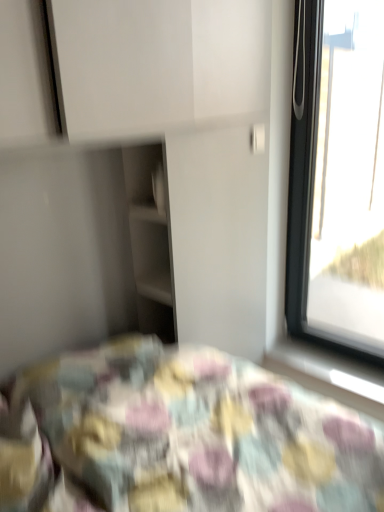
Identify the location of white plastic window sill at lower right. (329, 370).

Image resolution: width=384 pixels, height=512 pixels. Describe the element at coordinates (329, 370) in the screenshot. I see `white plastic window sill at lower right` at that location.

Where is `white plastic window sill at lower right`? white plastic window sill at lower right is located at coordinates (329, 370).